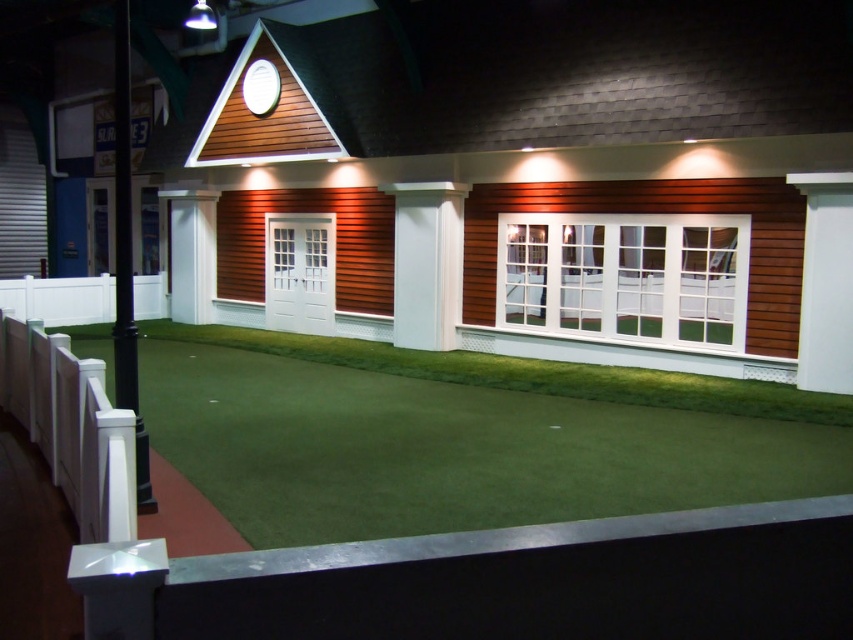
Question: Which point is closer to the camera?

Choices:
 (A) (160, 440)
 (B) (398, 324)

Answer: (A)

Question: Which object appears farthest from the camera in this image?

Choices:
 (A) green artificial turf at center
 (B) white smooth column at center

Answer: (B)

Question: Can you confirm if green artificial turf at center is positioned to the right of white smooth column at center?

Choices:
 (A) yes
 (B) no

Answer: (B)

Question: Does green artificial turf at center appear under white smooth column at center?

Choices:
 (A) yes
 (B) no

Answer: (A)

Question: Can you confirm if green artificial turf at center is positioned to the left of white smooth column at center?

Choices:
 (A) no
 (B) yes

Answer: (B)